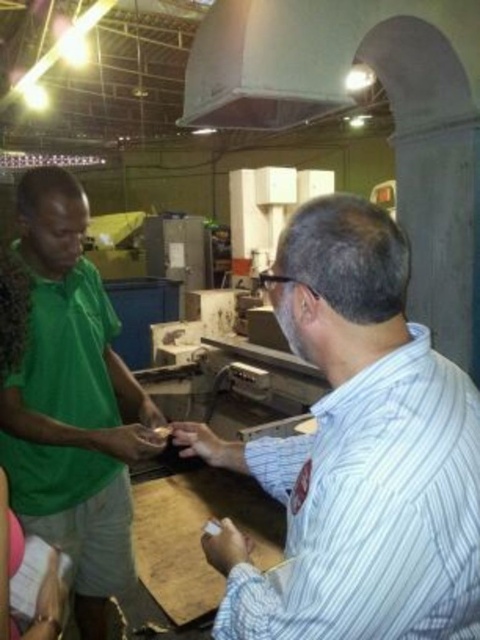
Who is positioned more to the left, green matte shirt at left or green fabric shirt at left?

green matte shirt at left

Is green matte shirt at left further to camera compared to green fabric shirt at left?

Yes, it is.

The width and height of the screenshot is (480, 640). I want to click on green matte shirt at left, so click(72, 403).

Does white striped shirt at right have a lesser width compared to green fabric shirt at left?

Incorrect, white striped shirt at right's width is not less than green fabric shirt at left's.

Between white striped shirt at right and green fabric shirt at left, which one has more height?

Standing taller between the two is green fabric shirt at left.

Which is behind, point (354, 308) or point (41, 637)?

Point (41, 637)

You are a GUI agent. You are given a task and a screenshot of the screen. Output one action in this format:
    pyautogui.click(x=<x>, y=<y>)
    Task: Click on the white striped shirt at right
    This screenshot has width=480, height=640.
    Given the screenshot: What is the action you would take?
    pyautogui.click(x=358, y=452)

Which is more to the right, white striped shirt at right or green matte shirt at left?

Positioned to the right is white striped shirt at right.

Is white striped shirt at right smaller than green matte shirt at left?

Correct, white striped shirt at right occupies less space than green matte shirt at left.

The height and width of the screenshot is (640, 480). Identify the location of white striped shirt at right. (358, 452).